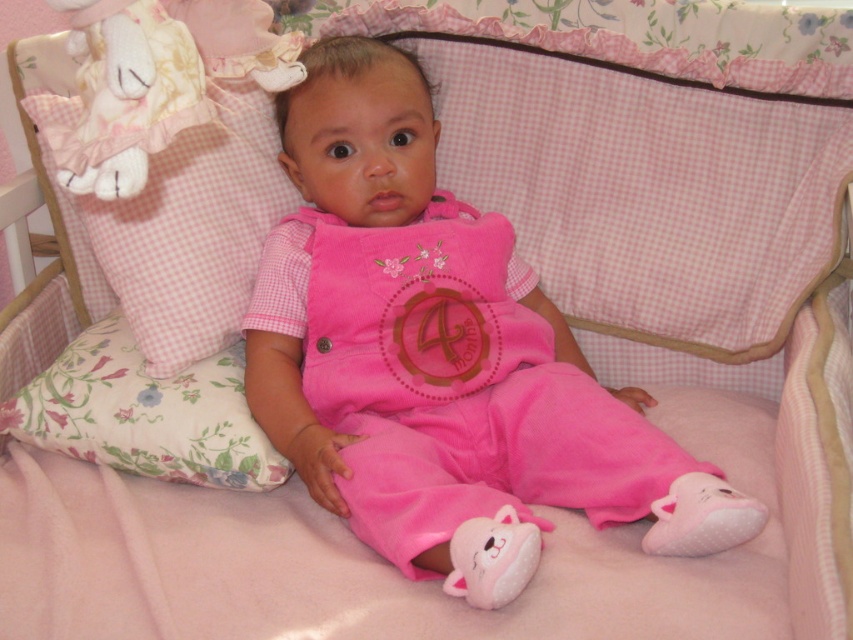
You are a parent checking the crib for the baby. You see the pink gingham pillow at upper left and the pink plush cat at lower center. Which object is located more to the left?

The pink gingham pillow at upper left is positioned on the left side of the pink plush cat at lower center, so the pink gingham pillow at upper left is more to the left.

Looking at this image, you are a parent standing near the crib and want to hand your baby the pink gingham pillow at upper left. Can you reach it without moving closer to the crib?

The pink gingham pillow at upper left is 81.48 centimeters away from viewer, so yes, the parent can reach it without moving closer to the crib.

You are a parent trying to place a pacifier on the pink gingham pillow at upper left. Given that the crib has a coordinate system where the bottom left corner is the origin, can you confirm if the coordinates provided are suitable for placing the pacifier there?

The pink gingham pillow at upper left is located at coordinates point (x=157, y=81), so yes, the coordinates are suitable for placing the pacifier there.